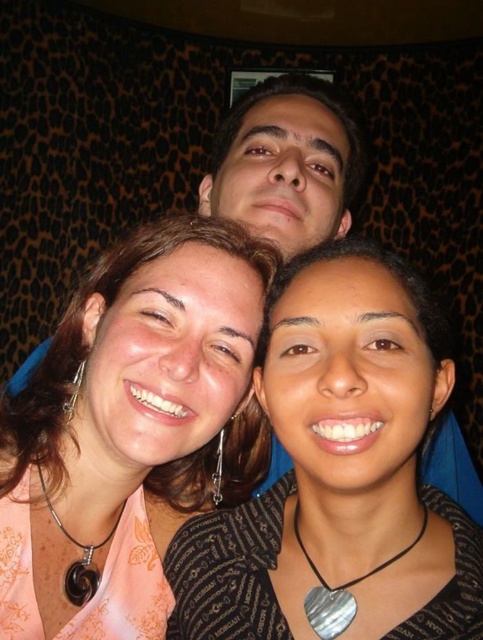
Question: Does matte black necklace at center have a larger size compared to black fabric at center?

Choices:
 (A) yes
 (B) no

Answer: (A)

Question: Which is nearer to the matte black necklace at center?

Choices:
 (A) matte black hair at center
 (B) black stone pendant at lower left
 (C) black fabric at center

Answer: (C)

Question: Can you confirm if matte black necklace at center is positioned above black stone pendant at lower left?

Choices:
 (A) yes
 (B) no

Answer: (A)

Question: Among these objects, which one is farthest from the camera?

Choices:
 (A) matte black necklace at center
 (B) silver heart-shaped pendant at center
 (C) matte black hair at center

Answer: (C)

Question: Which object is the closest to the black fabric at center?

Choices:
 (A) black stone pendant at lower left
 (B) silver heart-shaped pendant at center
 (C) matte black necklace at center

Answer: (B)

Question: Does matte black necklace at center have a smaller size compared to matte black hair at center?

Choices:
 (A) yes
 (B) no

Answer: (B)